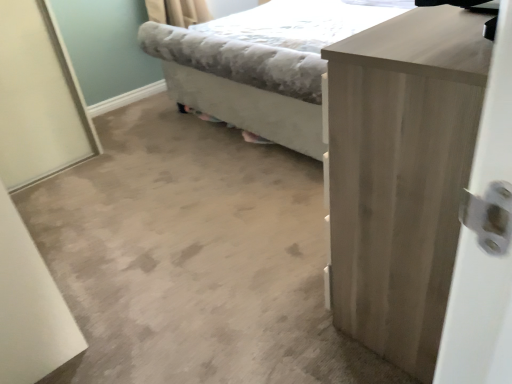
Question: Is light gray fabric bed at center taller or shorter than light wood cabinet at right?

Choices:
 (A) tall
 (B) short

Answer: (B)

Question: Based on their sizes in the image, would you say light gray fabric bed at center is bigger or smaller than light wood cabinet at right?

Choices:
 (A) big
 (B) small

Answer: (A)

Question: Is light gray fabric bed at center in front of or behind light wood cabinet at right in the image?

Choices:
 (A) front
 (B) behind

Answer: (B)

Question: Considering the positions of light wood cabinet at right and light gray fabric bed at center in the image, is light wood cabinet at right wider or thinner than light gray fabric bed at center?

Choices:
 (A) thin
 (B) wide

Answer: (A)

Question: Is point (348, 228) positioned closer to the camera than point (245, 31)?

Choices:
 (A) farther
 (B) closer

Answer: (B)

Question: In terms of height, does light wood cabinet at right look taller or shorter compared to light gray fabric bed at center?

Choices:
 (A) tall
 (B) short

Answer: (A)

Question: From the image's perspective, is light wood cabinet at right above or below light gray fabric bed at center?

Choices:
 (A) above
 (B) below

Answer: (B)